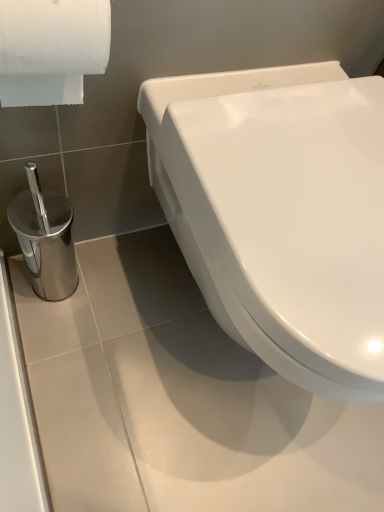
Question: Considering the positions of white glossy toilet at center and white textured toilet paper at upper left in the image, is white glossy toilet at center bigger or smaller than white textured toilet paper at upper left?

Choices:
 (A) small
 (B) big

Answer: (B)

Question: Relative to white textured toilet paper at upper left, is white glossy toilet at center in front or behind?

Choices:
 (A) front
 (B) behind

Answer: (B)

Question: Is white glossy toilet at center situated inside white textured toilet paper at upper left or outside?

Choices:
 (A) outside
 (B) inside

Answer: (A)

Question: Looking at their shapes, would you say white textured toilet paper at upper left is wider or thinner than white glossy toilet at center?

Choices:
 (A) wide
 (B) thin

Answer: (B)

Question: Considering the positions of white textured toilet paper at upper left and white glossy toilet at center in the image, is white textured toilet paper at upper left bigger or smaller than white glossy toilet at center?

Choices:
 (A) big
 (B) small

Answer: (B)

Question: From a real-world perspective, is white textured toilet paper at upper left physically located above or below white glossy toilet at center?

Choices:
 (A) above
 (B) below

Answer: (A)

Question: Is point (38, 61) closer or farther from the camera than point (304, 125)?

Choices:
 (A) farther
 (B) closer

Answer: (B)